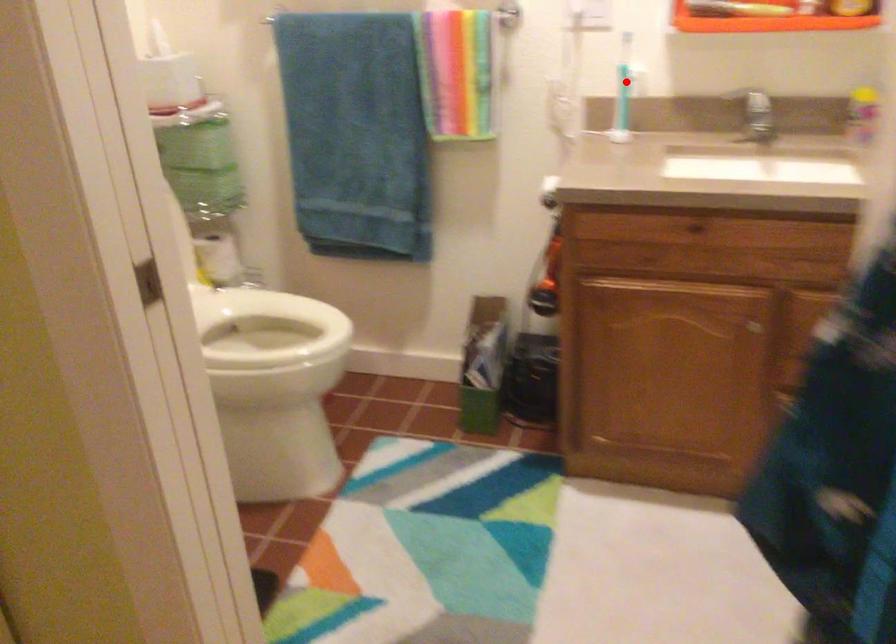
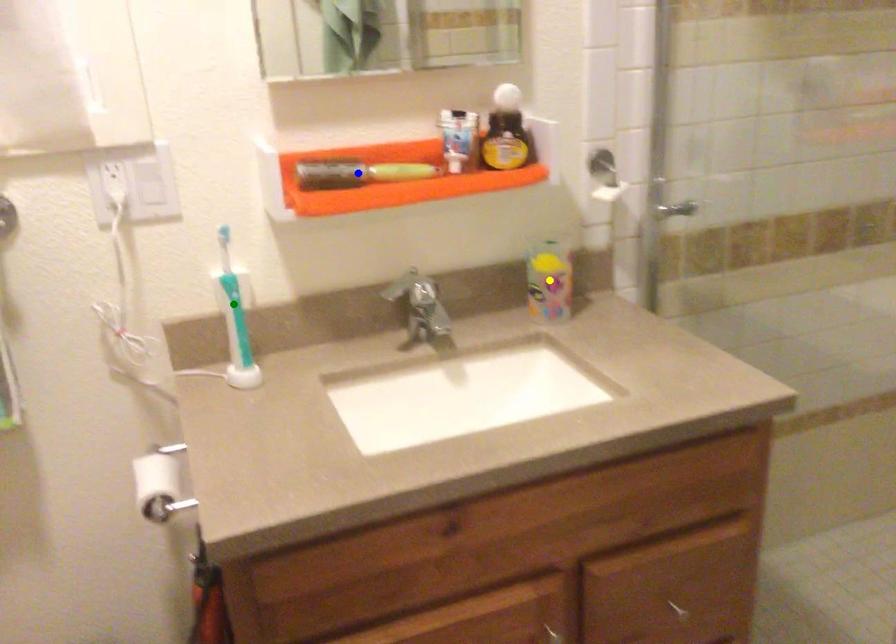
Question: I am providing you with two images of the same scene from different viewpoints. A red point is marked on the first image. You are given multiple points on the second image. Can you choose the point in image 2 that corresponds to the point in image 1?

Choices:
 (A) green point
 (B) blue point
 (C) yellow point

Answer: (A)